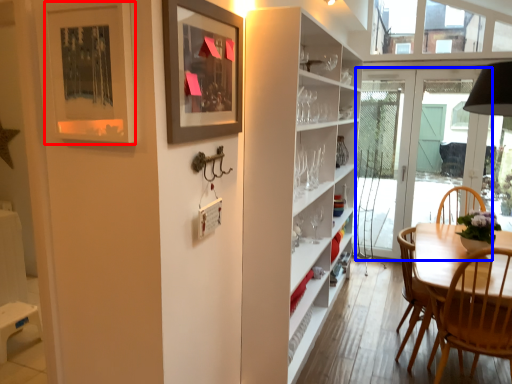
Question: Which object is closer to the camera taking this photo, picture frame (highlighted by a red box) or door (highlighted by a blue box)?

Choices:
 (A) picture frame
 (B) door

Answer: (A)